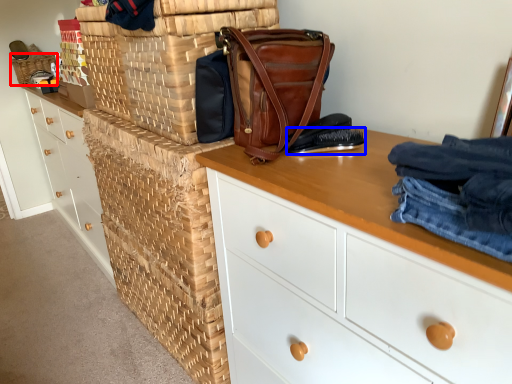
Question: Which object appears closest to the camera in this image, basket (highlighted by a red box) or shoe (highlighted by a blue box)?

Choices:
 (A) basket
 (B) shoe

Answer: (B)